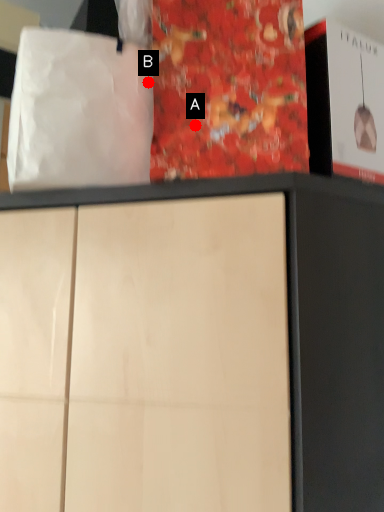
Question: Two points are circled on the image, labeled by A and B beside each circle. Which point is farther to the camera?

Choices:
 (A) A is further
 (B) B is further

Answer: (B)